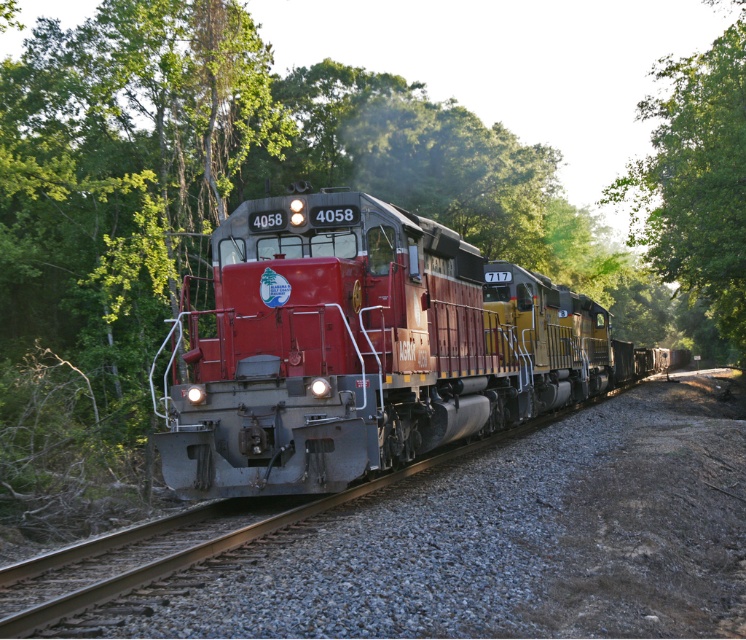
This screenshot has width=746, height=640. Describe the element at coordinates (366, 348) in the screenshot. I see `matte red train at center` at that location.

Where is `matte red train at center`? matte red train at center is located at coordinates (366, 348).